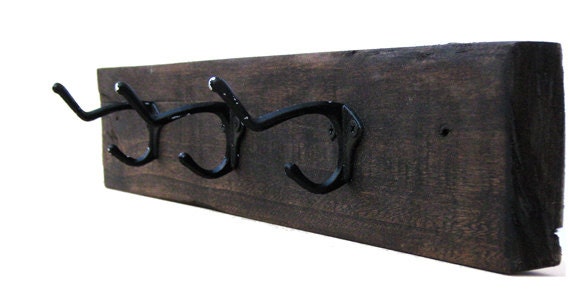
Find the location of `top hanger`. top hanger is located at coordinates (223, 90), (123, 92), (67, 97).